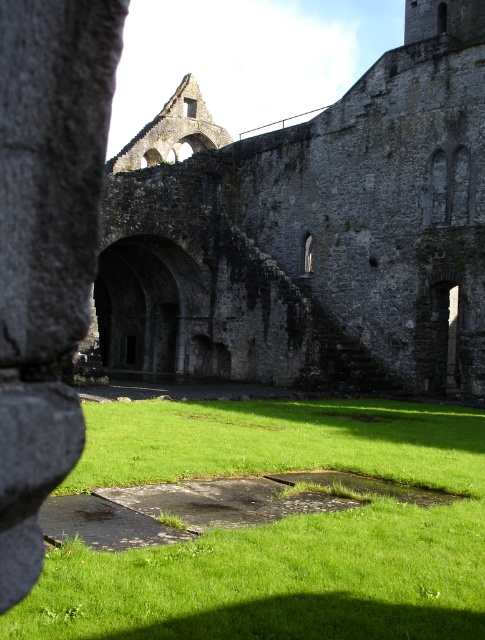
Question: Does stone archway at center have a larger size compared to green grass at center?

Choices:
 (A) yes
 (B) no

Answer: (A)

Question: Can you confirm if stone archway at center is wider than green grass at center?

Choices:
 (A) yes
 (B) no

Answer: (A)

Question: Does stone archway at center have a smaller size compared to green grass at center?

Choices:
 (A) no
 (B) yes

Answer: (A)

Question: Which object is farther from the camera taking this photo?

Choices:
 (A) green grass at center
 (B) stone archway at center

Answer: (B)